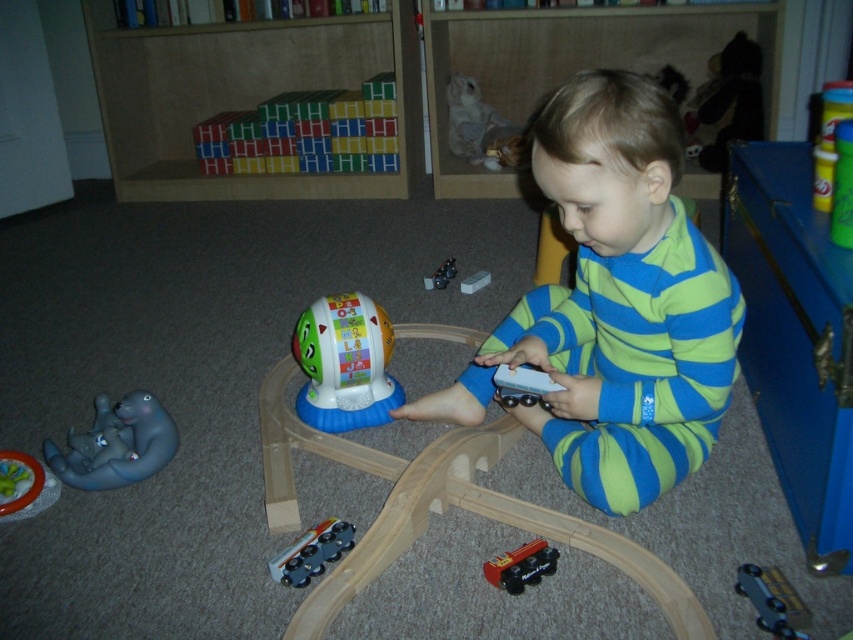
Question: From the image, what is the correct spatial relationship of metallic silver train at center in relation to white plastic train at center?

Choices:
 (A) left
 (B) right

Answer: (A)

Question: Considering the real-world distances, which object is farthest from the green plastic educational toy at center?

Choices:
 (A) white plastic train at center
 (B) rubber elephant at lower left

Answer: (A)

Question: Which object is farther from the camera taking this photo?

Choices:
 (A) smooth plastic train at center
 (B) rubber elephant at lower left

Answer: (B)

Question: Which of the following is the farthest from the observer?

Choices:
 (A) rubber elephant at lower left
 (B) metallic silver train at center

Answer: (B)

Question: Does wooden blocks at upper center come behind green plastic educational toy at center?

Choices:
 (A) no
 (B) yes

Answer: (B)

Question: Does rubberized plastic blocks at upper center have a greater width compared to metallic silver train at center?

Choices:
 (A) no
 (B) yes

Answer: (B)